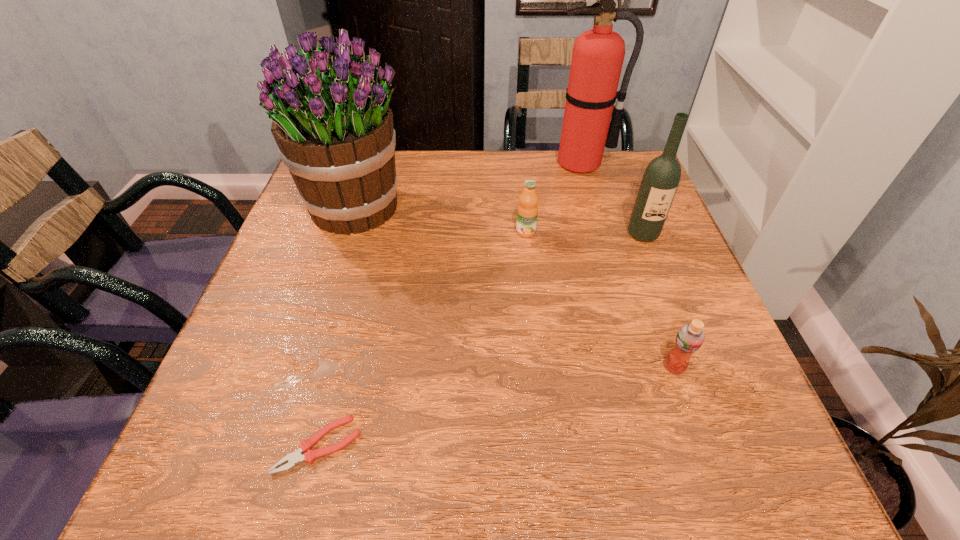
Identify the location of fire extinguisher located at the right edge. (598, 54).

You are a GUI agent. You are given a task and a screenshot of the screen. Output one action in this format:
    pyautogui.click(x=<x>, y=<y>)
    Task: Click on the wine bottle located in the right edge section of the desktop
    This screenshot has height=540, width=960.
    Given the screenshot: What is the action you would take?
    pyautogui.click(x=660, y=181)

Locate an element on the screen. The height and width of the screenshot is (540, 960). orange juice located at the right edge is located at coordinates (690, 337).

You are a GUI agent. You are given a task and a screenshot of the screen. Output one action in this format:
    pyautogui.click(x=<x>, y=<y>)
    Task: Click on the object present at the far left corner
    Image resolution: width=960 pixels, height=540 pixels.
    Given the screenshot: What is the action you would take?
    pyautogui.click(x=331, y=120)

Where is `object at the near left corner`? object at the near left corner is located at coordinates (309, 456).

I want to click on object that is at the far right corner, so click(x=598, y=54).

I want to click on blank area at the far edge, so click(x=500, y=186).

This screenshot has width=960, height=540. Find the location of `free region at the near edge`. free region at the near edge is located at coordinates (374, 465).

You are a GUI agent. You are given a task and a screenshot of the screen. Output one action in this format:
    pyautogui.click(x=<x>, y=<y>)
    Task: Click on the vacant space at the right edge of the desktop
    The height and width of the screenshot is (540, 960).
    Given the screenshot: What is the action you would take?
    pyautogui.click(x=669, y=295)

In the image, there is a desktop. Where is `vacant area at the far right corner`? vacant area at the far right corner is located at coordinates (637, 188).